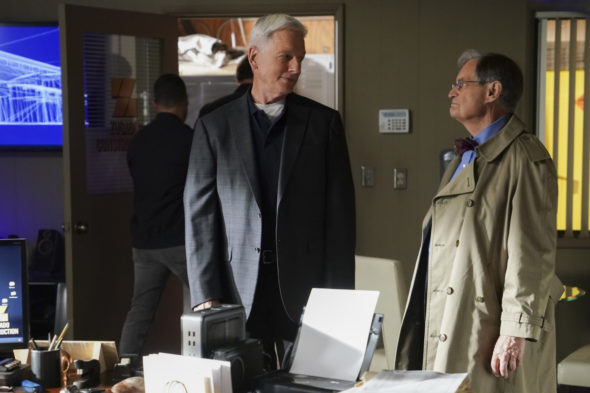
At what (x,y) coordinates should I click in order to perform the action: click on coffee cup full of pencils. Please return your answer as a coordinate pair (x, y). Looking at the image, I should click on (44, 372).